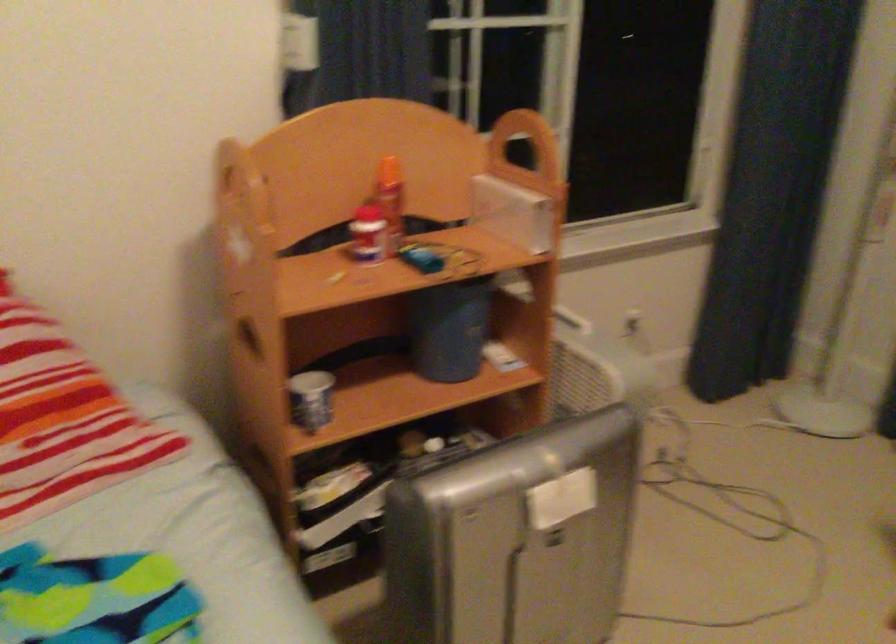
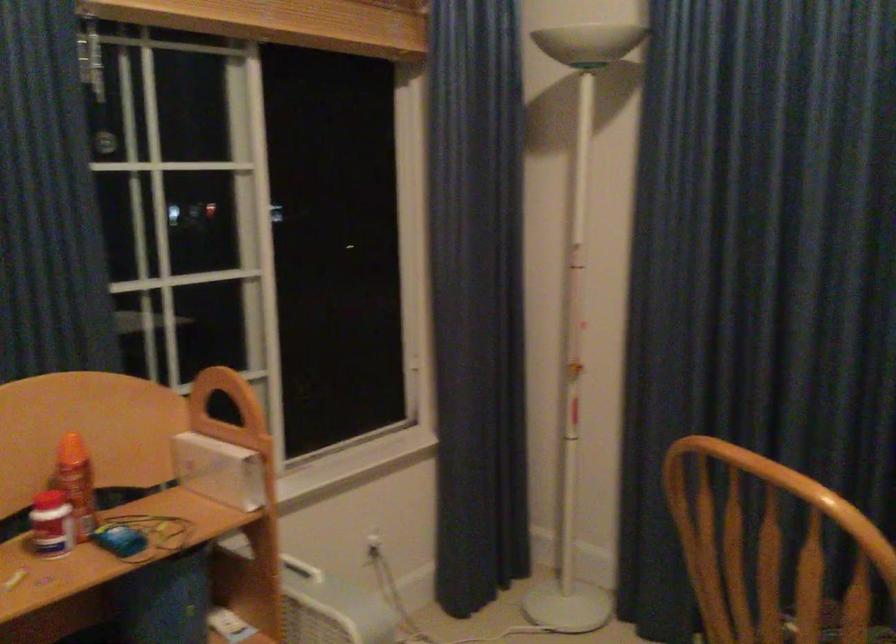
In a continuous first-person perspective shot, in which direction is the camera moving?

The cameraman walked toward right, backward.